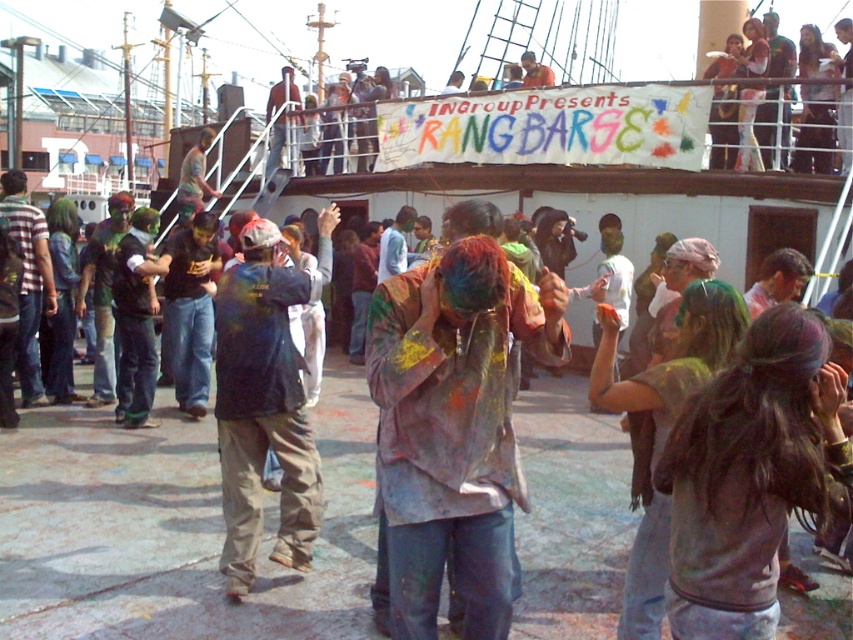
Is point (276, 112) positioned behind point (532, 56)?

Yes.

I want to click on brown leather jacket at upper center, so click(282, 93).

Find the location of a particular element. This screenshot has width=853, height=640. brown leather jacket at upper center is located at coordinates (282, 93).

Which is more to the left, dark blue jeans at center or matte black shirt at upper right?

Positioned to the left is dark blue jeans at center.

Does dark blue jeans at center have a greater width compared to matte black shirt at upper right?

Yes.

Which is behind, point (132, 339) or point (764, 124)?

Positioned behind is point (764, 124).

Locate an element on the screen. dark blue jeans at center is located at coordinates (135, 321).

Is dark blue jeans at center to the left of multicolored paint-covered shirt at center from the viewer's perspective?

In fact, dark blue jeans at center is to the right of multicolored paint-covered shirt at center.

Between dark blue jeans at center and multicolored paint-covered shirt at center, which one has less height?

dark blue jeans at center is shorter.

This screenshot has height=640, width=853. What are the coordinates of `dark blue jeans at center` in the screenshot? It's located at (135, 321).